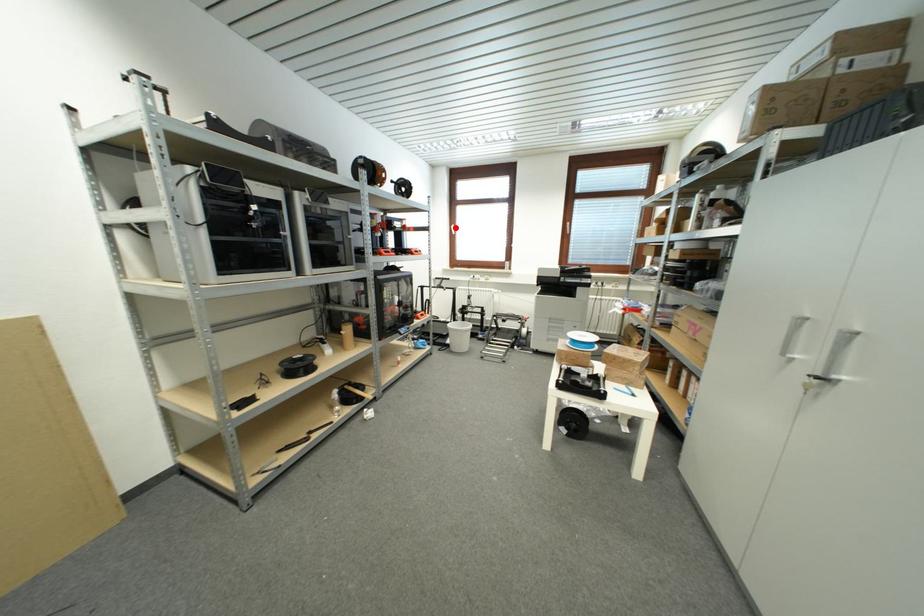
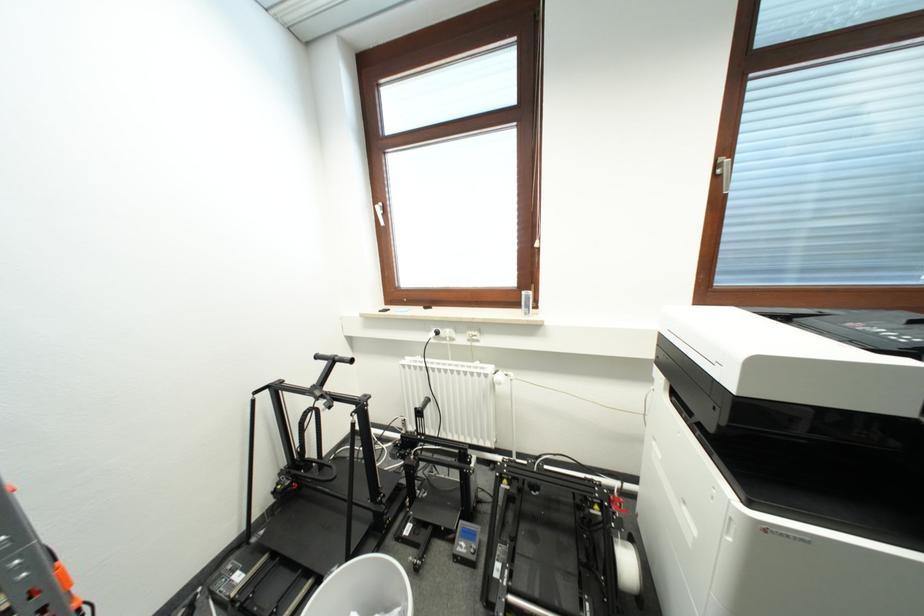
Locate, in the second image, the point that corresponds to the highlighted location in the first image.

(379, 206)